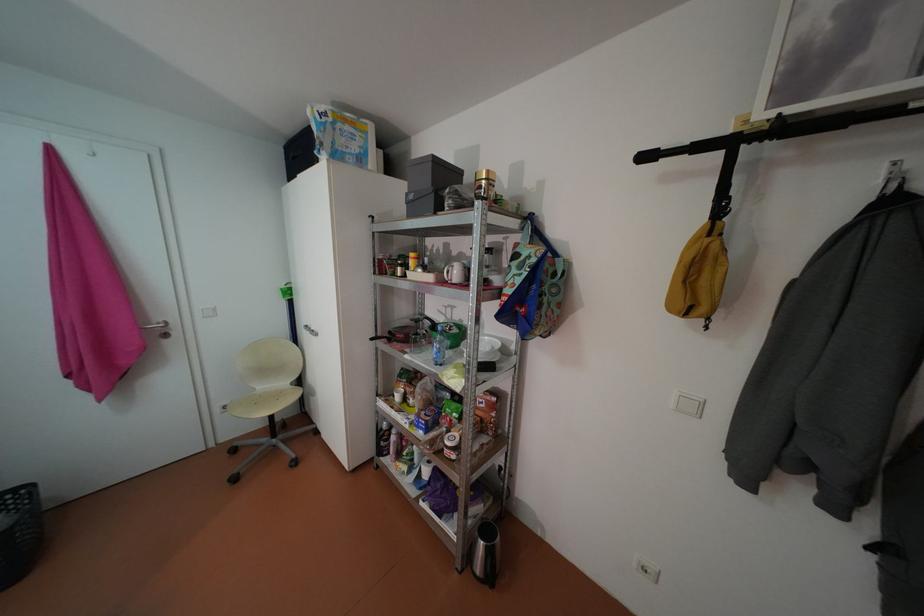
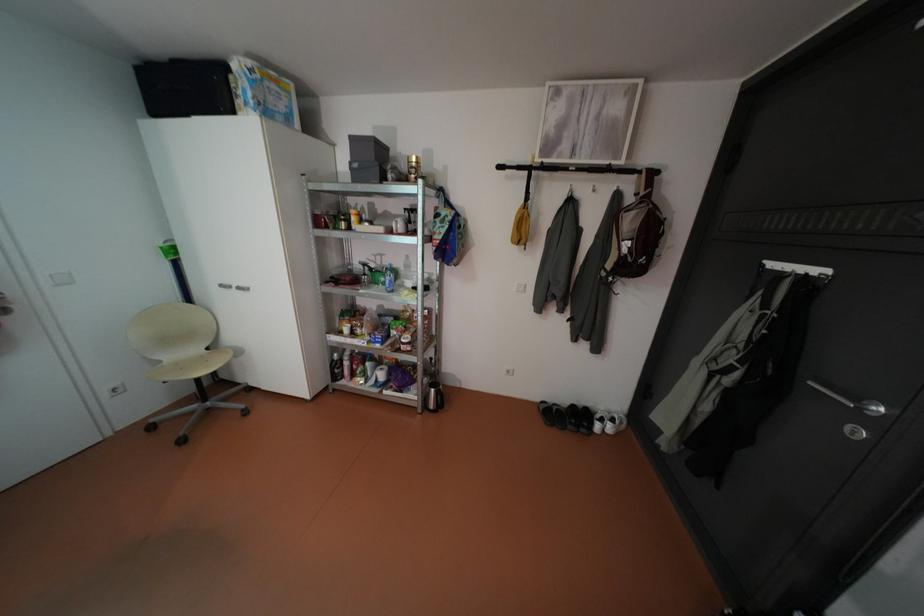
The point at [488,565] is marked in the first image. Where is the corresponding point in the second image?

(441, 405)